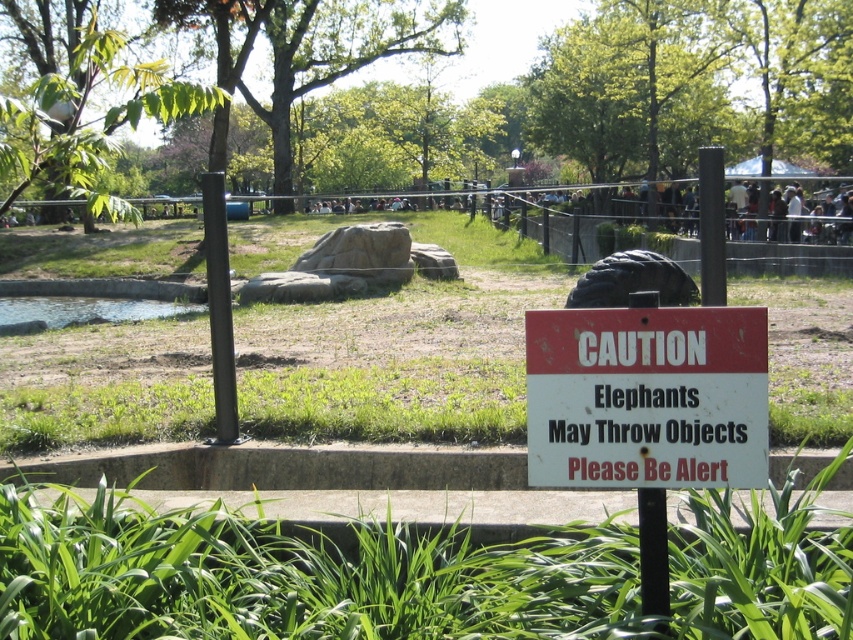
You are a zoo visitor standing in front of the enclosure. You see the green leafy grass at lower center and the black metal fence at upper center. Which object is closer to your feet?

The green leafy grass at lower center is closer to your feet because it is positioned below the black metal fence at upper center.

You are a zoo visitor holding a 1 meter wide blanket. You want to spread it out on the ground between the white paper sign at center and the black metal fence at upper center. Considering their widths, will the blanket fit without overlapping either object?

The white paper sign at center has a lesser width compared to the black metal fence at upper center. Since the blanket is 1 meter wide, it may fit between them if there is sufficient space, but the exact placement depends on the distance between the two objects, not just their widths.

You are a zoo visitor standing at the observation point. You notice two points marked in the enclosure. Which point is closer to you, point at coordinates (164, 625) or point at coordinates (553, 470)?

Point at coordinates (164, 625) is closer to you because it is further to the viewer than point at coordinates (553, 470).